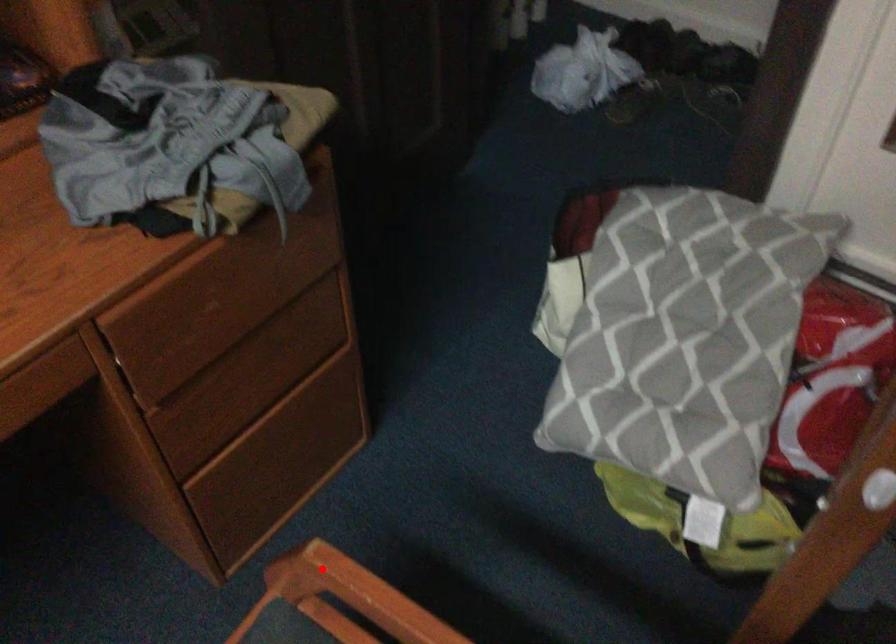
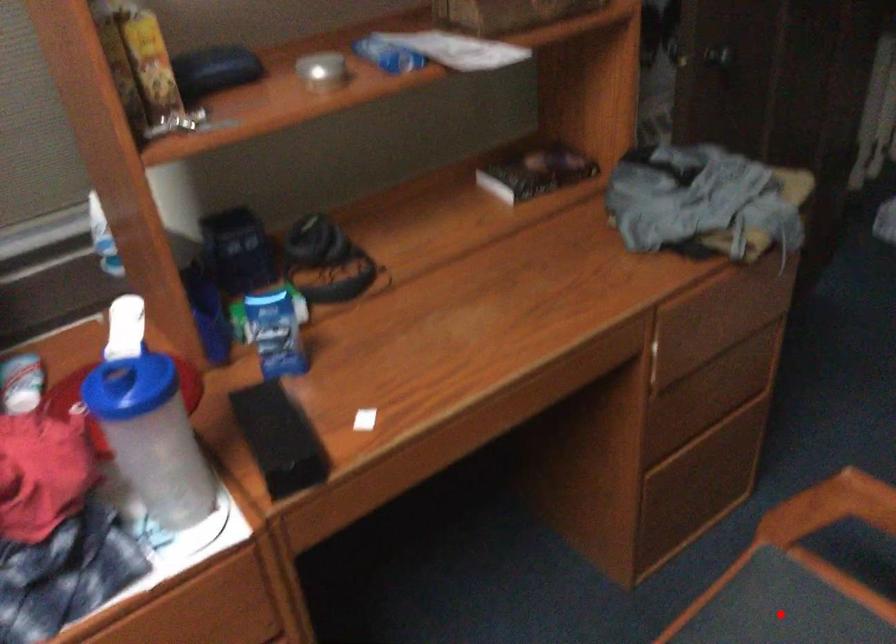
I am providing you with two images of the same scene from different viewpoints. A red point is marked on the first image and another point is marked on the second image. Do the highlighted points in image1 and image2 indicate the same real-world spot?

No